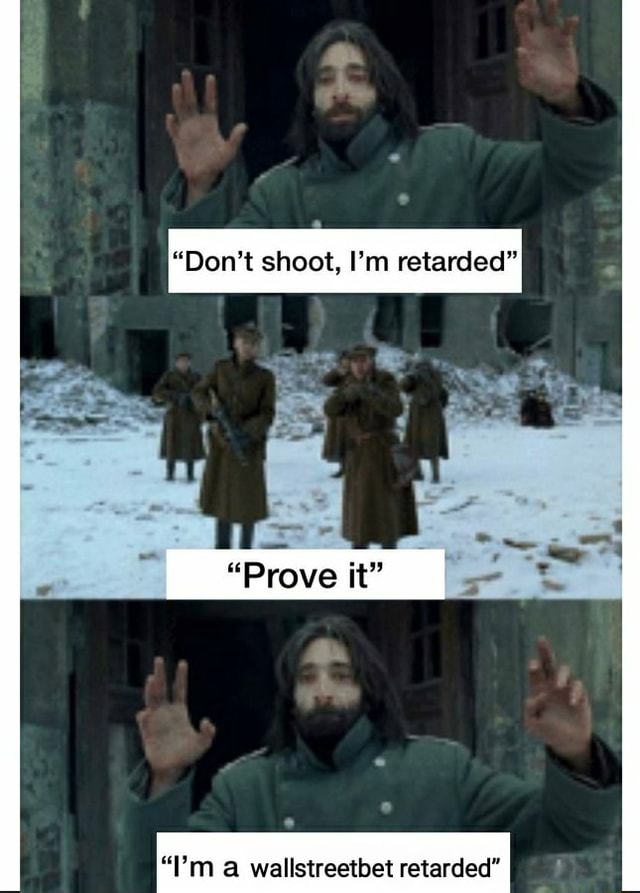
Find the location of a particular element. This screenshot has width=640, height=893. doors is located at coordinates (429, 699), (115, 710), (468, 54), (232, 63), (593, 355).